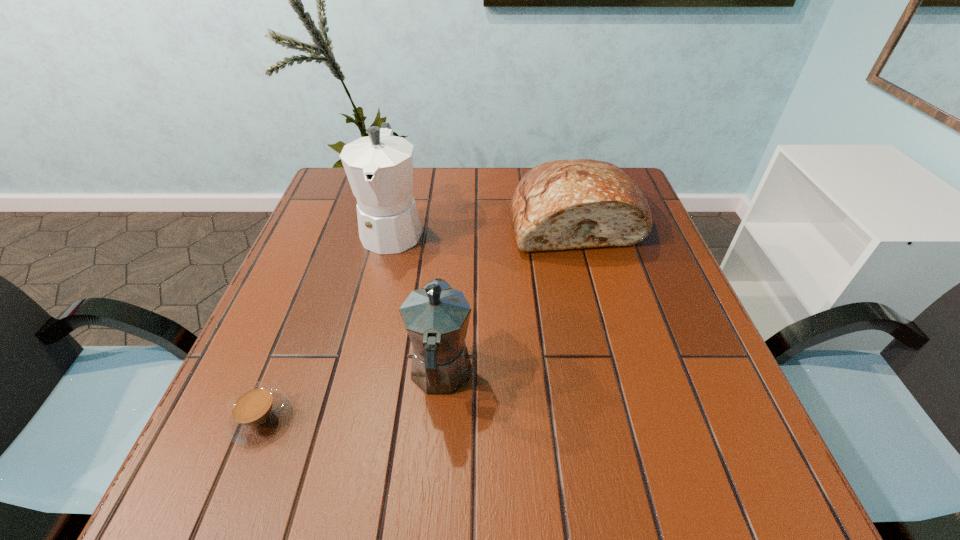
You are a GUI agent. You are given a task and a screenshot of the screen. Output one action in this format:
    pyautogui.click(x=<x>, y=<y>)
    Task: Click on the free spot between the third shortest object and the third tallest object
    
    Given the screenshot: What is the action you would take?
    pyautogui.click(x=508, y=298)

Identify the location of free spot between the third object from left to right and the rightmost object. (508, 298).

Where is `vacant area that lies between the cappuccino and the third object from right to left`? Image resolution: width=960 pixels, height=540 pixels. vacant area that lies between the cappuccino and the third object from right to left is located at coordinates (326, 324).

This screenshot has width=960, height=540. I want to click on free space between the tallest object and the leftmost object, so click(x=326, y=324).

Identify the location of object that ranks as the third closest to the rightmost object. (256, 413).

Locate an element on the screen. The height and width of the screenshot is (540, 960). object that is the second closest to the cappuccino is located at coordinates (379, 167).